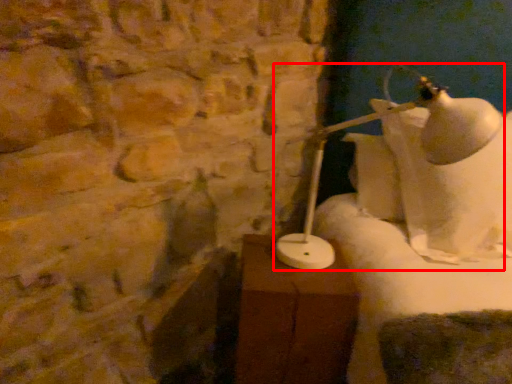
Question: Where is lamp (annotated by the red box) located in relation to table in the image?

Choices:
 (A) right
 (B) left

Answer: (A)